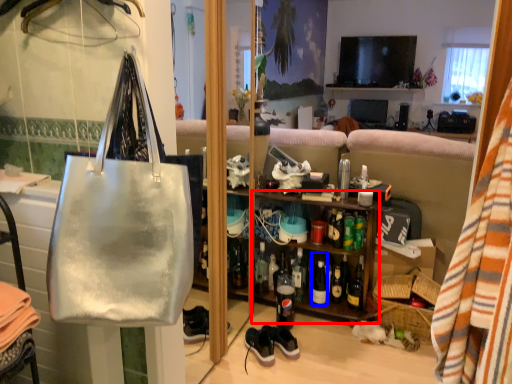
Question: Which point is closer to the camera, shelf (highlighted by a red box) or bottle (highlighted by a blue box)?

Choices:
 (A) shelf
 (B) bottle

Answer: (A)